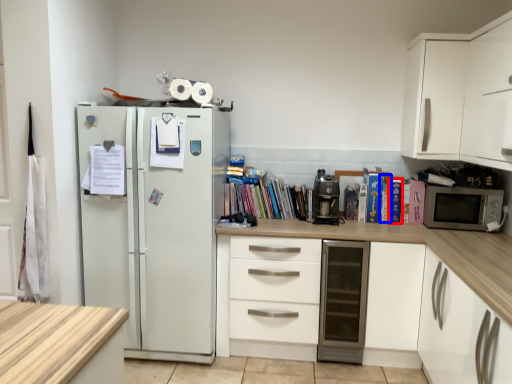
Question: Among these objects, which one is nearest to the camera, paperback book (highlighted by a red box) or paperback book (highlighted by a blue box)?

Choices:
 (A) paperback book
 (B) paperback book

Answer: (A)